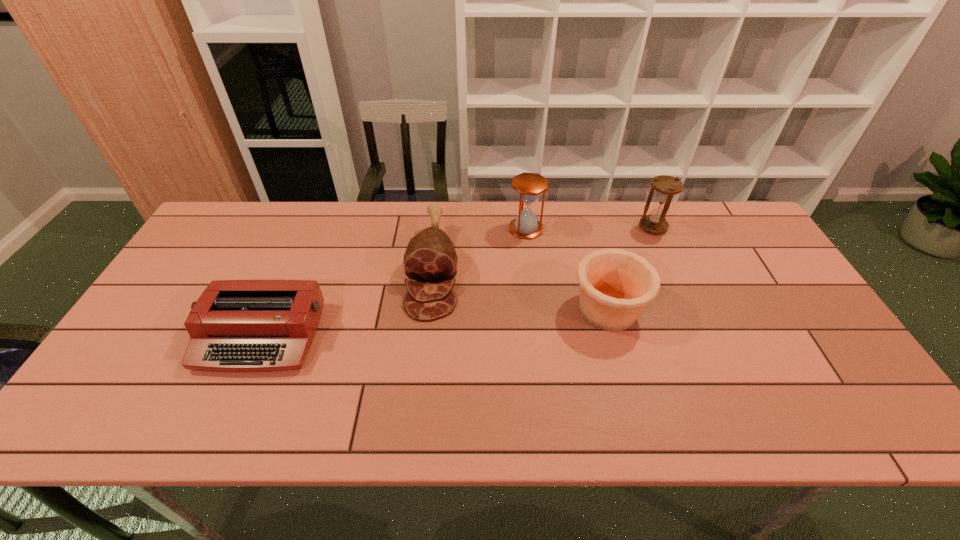
You are a GUI agent. You are given a task and a screenshot of the screen. Output one action in this format:
    pyautogui.click(x=<x>, y=<y>)
    Task: Click on the right hourglass
    The height and width of the screenshot is (540, 960).
    Given the screenshot: What is the action you would take?
    pyautogui.click(x=666, y=187)

This screenshot has height=540, width=960. In order to click on the third object from left to right in this screenshot , I will do `click(529, 186)`.

What are the coordinates of `the fourth object from right to left` in the screenshot? It's located at 430,257.

Where is `the fourth object from left to right`? This screenshot has width=960, height=540. the fourth object from left to right is located at coordinates (615, 285).

The width and height of the screenshot is (960, 540). I want to click on typewriter, so click(x=235, y=325).

Where is `the shortest object`? The image size is (960, 540). the shortest object is located at coordinates (235, 325).

This screenshot has width=960, height=540. I want to click on vacant area located 0.080m on the right of the rightmost object, so click(x=691, y=227).

What are the coordinates of `free space located 0.080m on the front of the third object from right to left` in the screenshot? It's located at (529, 257).

This screenshot has height=540, width=960. Find the location of `free spot located at the sliced end of the second object from left to right`. free spot located at the sliced end of the second object from left to right is located at coordinates (424, 343).

Where is `vacant space located on the right of the pottery`? The image size is (960, 540). vacant space located on the right of the pottery is located at coordinates (757, 309).